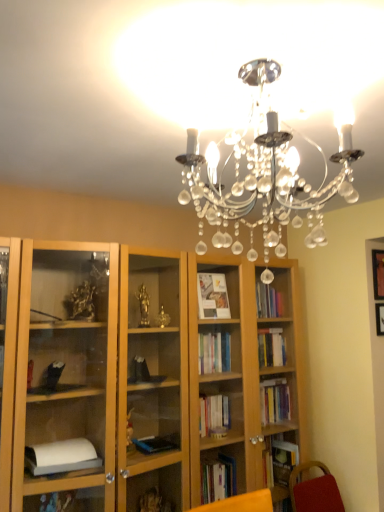
Where is `free space above clear crystal chandelier at center (from a real-world perspective)`? Image resolution: width=384 pixels, height=512 pixels. free space above clear crystal chandelier at center (from a real-world perspective) is located at coordinates (290, 65).